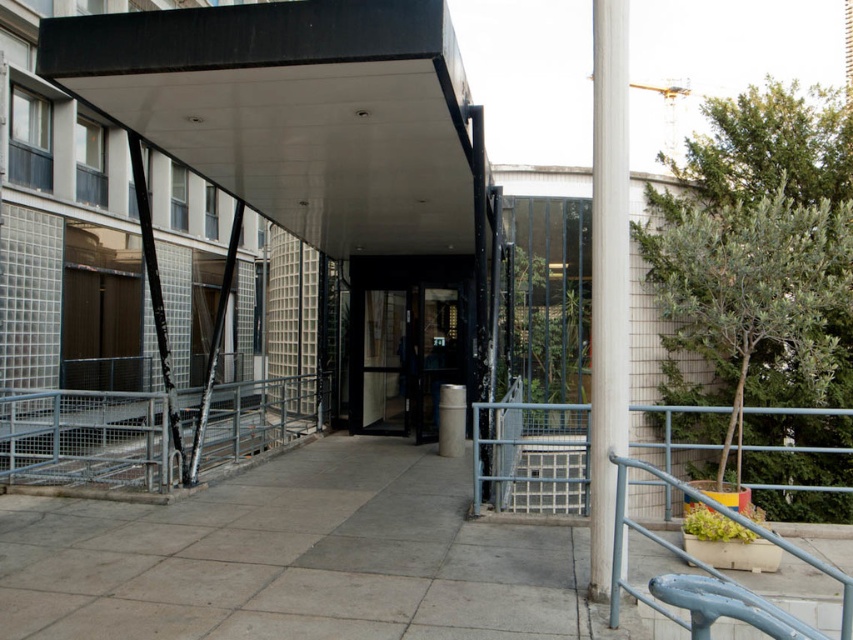
You are a delivery person approaching the entrance of the building. You need to place a package on the blue painted metal railing at lower right before proceeding to the metallic grid stair at center. Can you easily move from the stair to the railing to place the package?

The blue painted metal railing at lower right is to the left of the metallic grid stair at center, so you can easily move from the stair to the railing to place the package.